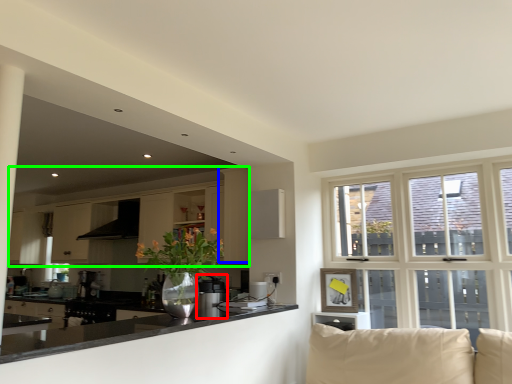
Question: Based on their relative distances, which object is farther from appliance (highlighted by a red box)? Choose from cabinetry (highlighted by a blue box) and cabinetry (highlighted by a green box).

Choices:
 (A) cabinetry
 (B) cabinetry

Answer: (B)